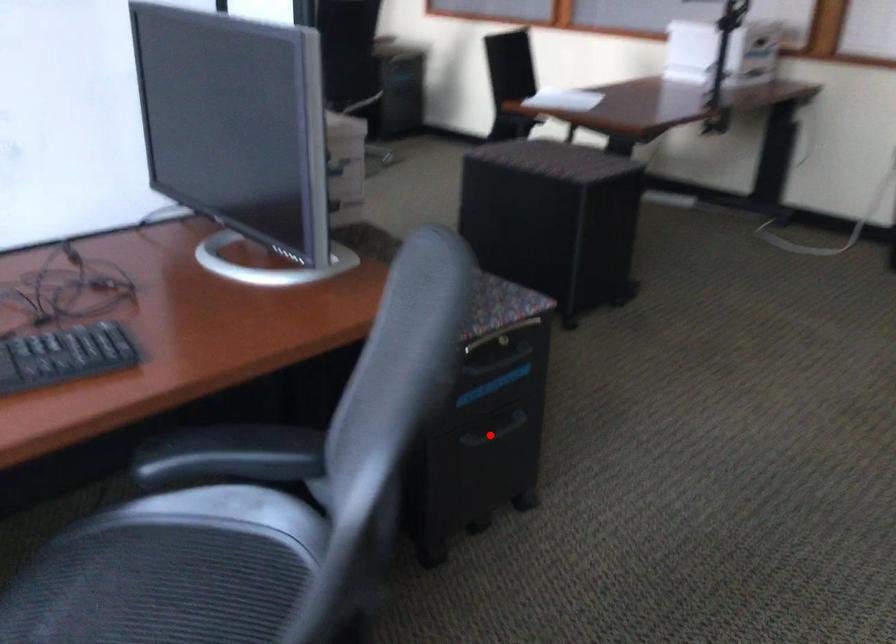
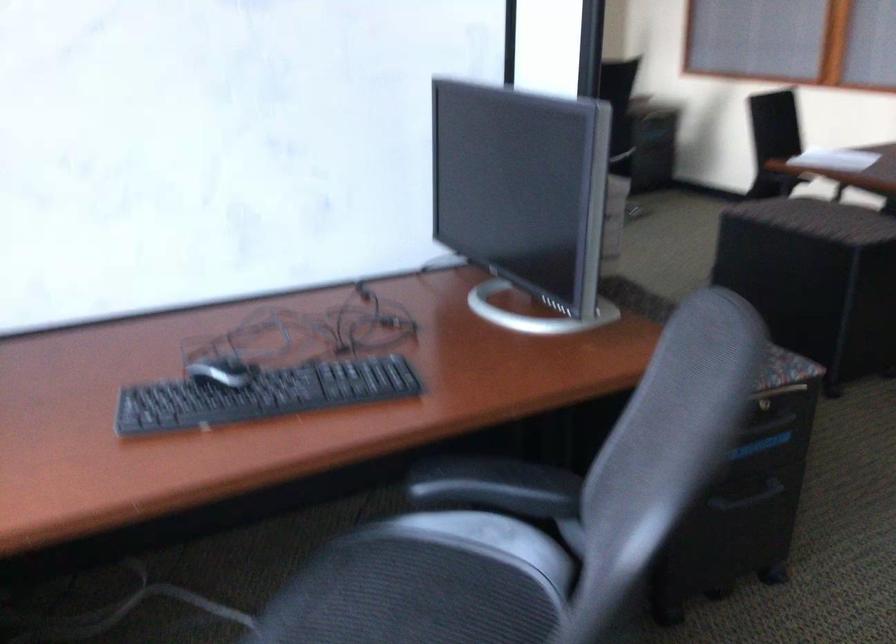
Locate, in the second image, the point that corresponds to the highlighted location in the first image.

(747, 497)